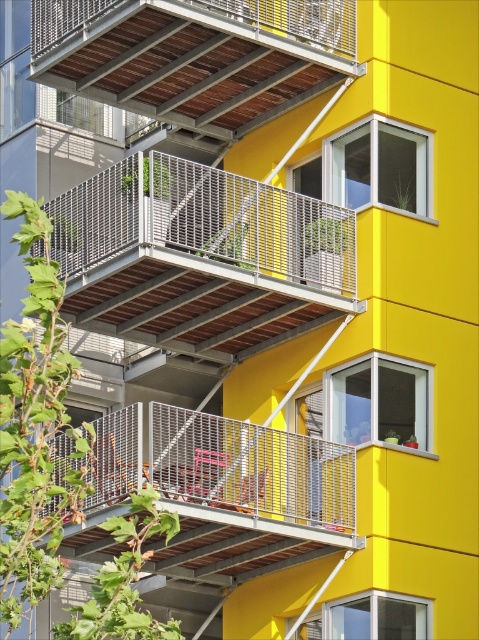
Which is in front, point (102, 259) or point (328, 38)?

Point (102, 259)

Between point (174, 314) and point (196, 109), which one is positioned behind?

Positioned behind is point (196, 109).

Is point (117, 292) positioned in front of point (345, 42)?

Yes, point (117, 292) is in front of point (345, 42).

Find the location of `metallic gray balcony at upper center`. metallic gray balcony at upper center is located at coordinates click(200, 257).

Can you confirm if metallic gray balcony at upper center is shorter than metallic gray balcony at center?

No.

Is metallic gray balcony at upper center positioned at the back of metallic gray balcony at center?

No, it is in front of metallic gray balcony at center.

In order to click on metallic gray balcony at upper center in this screenshot , I will do `click(200, 257)`.

This screenshot has height=640, width=479. In order to click on metallic gray balcony at upper center in this screenshot , I will do `click(200, 257)`.

Which is below, metallic brown balcony at upper center or metallic gray balcony at center?

metallic gray balcony at center is below.

Is metallic brown balcony at upper center to the left of metallic gray balcony at center from the viewer's perspective?

Yes, metallic brown balcony at upper center is to the left of metallic gray balcony at center.

This screenshot has width=479, height=640. Find the location of `metallic brown balcony at upper center`. metallic brown balcony at upper center is located at coordinates (195, 54).